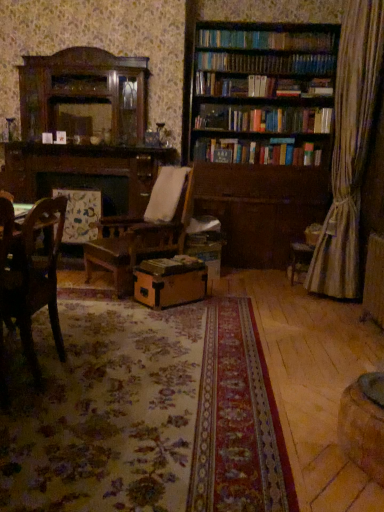
The width and height of the screenshot is (384, 512). What are the coordinates of `vacant area that is in front of brown cardboard box at center` in the screenshot? It's located at (177, 315).